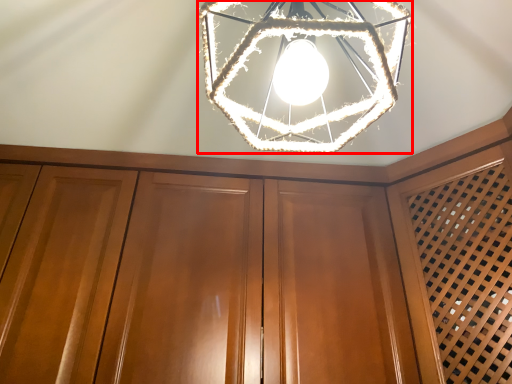
Question: From the image's perspective, where is lamp (annotated by the red box) located relative to dresser?

Choices:
 (A) above
 (B) below

Answer: (A)